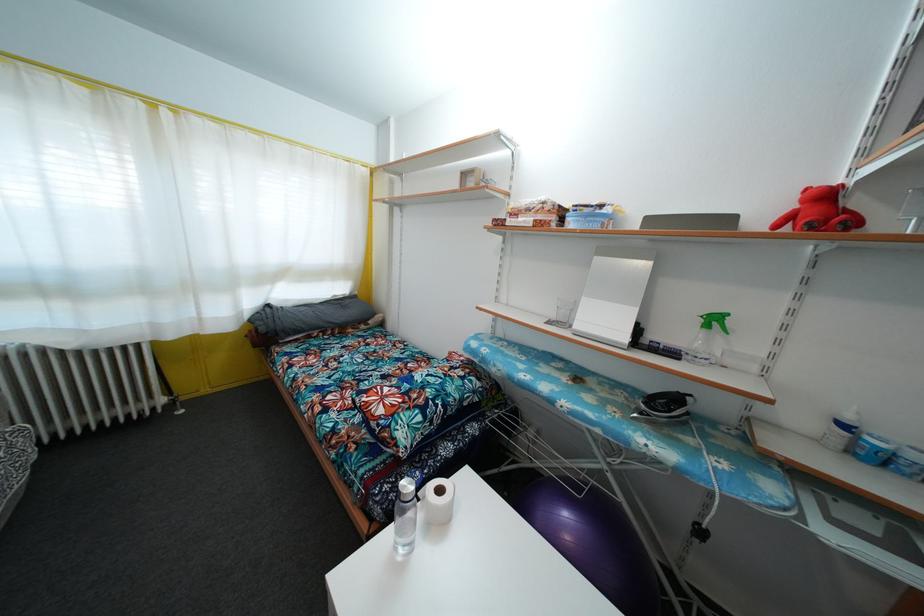
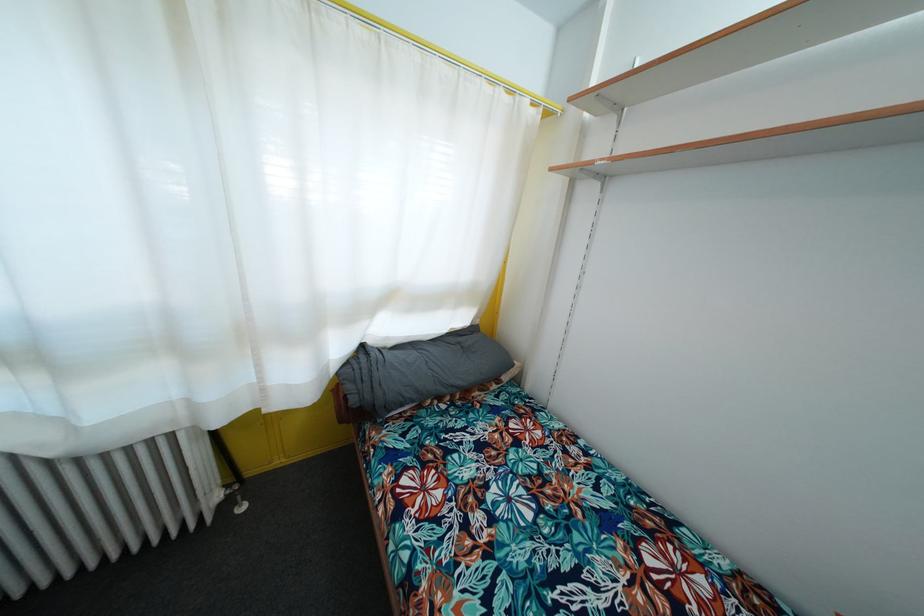
What movement of the cameraman would produce the second image?

The cameraman walked toward left, forward.